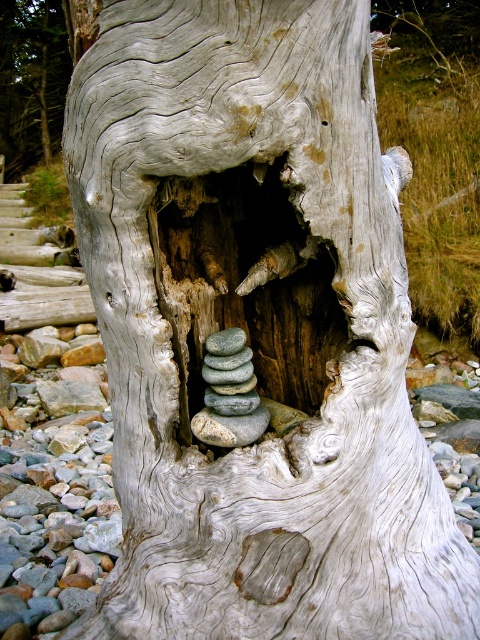
Question: Is gray wood hole at center above smooth gray bark at center?

Choices:
 (A) no
 (B) yes

Answer: (A)

Question: Does gray wood hole at center appear under smooth gray bark at center?

Choices:
 (A) no
 (B) yes

Answer: (B)

Question: Considering the relative positions of gray wood hole at center and smooth gray bark at center in the image provided, where is gray wood hole at center located with respect to smooth gray bark at center?

Choices:
 (A) below
 (B) above

Answer: (A)

Question: Which point is farther to the camera?

Choices:
 (A) gray wood hole at center
 (B) smooth gray bark at center

Answer: (B)